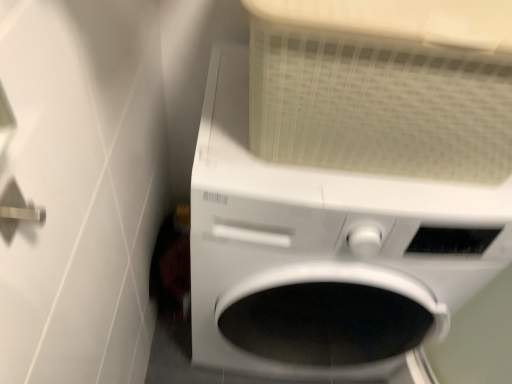
Question: Which is correct: silver metallic door handle at upper left is inside white matte washing machine at center, or outside of it?

Choices:
 (A) outside
 (B) inside

Answer: (A)

Question: Based on their positions, is silver metallic door handle at upper left located to the left or right of white matte washing machine at center?

Choices:
 (A) right
 (B) left

Answer: (B)

Question: Considering their positions, is silver metallic door handle at upper left located in front of or behind white matte washing machine at center?

Choices:
 (A) behind
 (B) front

Answer: (B)

Question: Based on their sizes in the image, would you say white matte washing machine at center is bigger or smaller than silver metallic door handle at upper left?

Choices:
 (A) small
 (B) big

Answer: (B)

Question: From the image's perspective, is white matte washing machine at center located above or below silver metallic door handle at upper left?

Choices:
 (A) above
 (B) below

Answer: (B)

Question: Is white matte washing machine at center inside the boundaries of silver metallic door handle at upper left, or outside?

Choices:
 (A) outside
 (B) inside

Answer: (A)

Question: From a real-world perspective, is white matte washing machine at center above or below silver metallic door handle at upper left?

Choices:
 (A) below
 (B) above

Answer: (A)